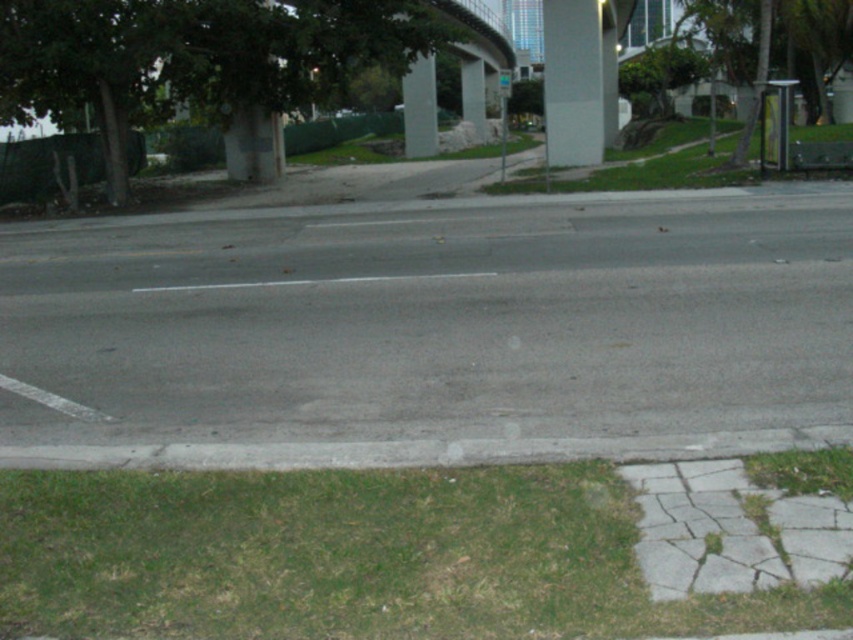
You are a pedestrian trying to read both the white plastic street sign at center and the white plastic sign at upper center. Which one do you think is bigger?

The white plastic street sign at center is larger in size compared to the white plastic sign at upper center.

You are a delivery person trying to navigate through the urban street scene. You need to deliver a package to the address located behind the gray concrete pillar at center. However, there is a white plastic street sign at center blocking your path. Can you go around the sign to reach the pillar?

The gray concrete pillar at center is above the white plastic street sign at center, meaning the pillar is positioned higher than the sign. Since the sign is below the pillar, you can go around the sign to reach the pillar as they are at different vertical levels.

You are a delivery person trying to read the signs on the street. Which of the two signs, the white plastic street sign at center or the white plastic sign at upper center, do you think is wider?

The white plastic street sign at center is wider than the white plastic sign at upper center.